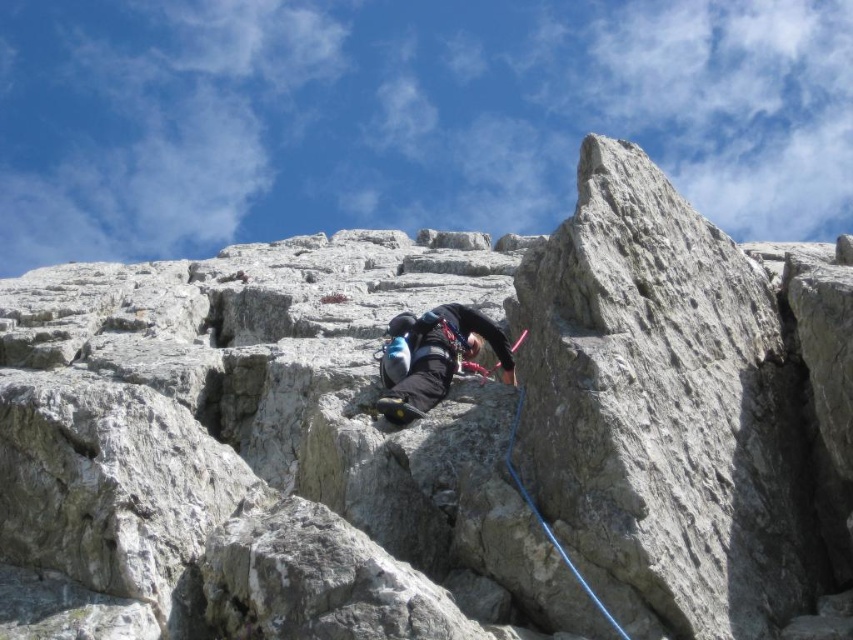
You are a photographer taking a picture of a climber on a mountain. You notice the black fabric helmet at center and the blue rubber rope at center. Which object should you zoom in on if you want to capture the larger object in your shot?

The black fabric helmet at center is larger in size than the blue rubber rope at center, so you should zoom in on the black fabric helmet at center to capture the larger object.

You are a safety inspector evaluating the climbing setup. The black fabric helmet at center and blue rubber rope at center are both critical components. According to safety standards, the helmet must be longer than the rope to ensure proper coverage. Is the current setup compliant?

The black fabric helmet at center is shorter than blue rubber rope at center, so the setup does not comply with safety standards as the helmet is not longer than the rope.

You are a drone operator tasked with capturing aerial footage of the climber. Your drone can fly up to 50 meters away from its starting position. If you are positioned at the same location as the viewer, will your drone be able to reach the black fabric helmet at center to film it?

The black fabric helmet at center and the viewer are 60.31 meters apart, which exceeds the drone maximum range of 50 meters. The drone cannot reach the black fabric helmet at center.